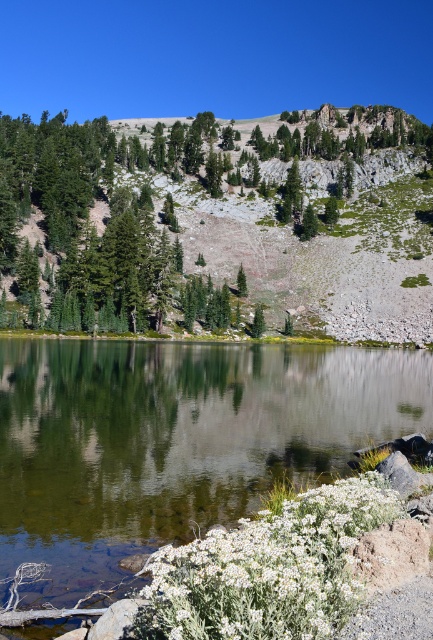
You are standing at the edge of the lake and want to walk towards the two points marked in the image. Which point, point (300, 438) or point (241, 276), will you reach first?

You will reach point (300, 438) first because it is closer to you than point (241, 276).

You are standing at the edge of the lake and want to take a photo of the green leafy trees at upper left. The camera you are using has a zoom lens that can focus on a specific point. If you aim the camera at point (220, 212), will it capture the green leafy trees at upper left?

Yes, because the point (220, 212) is on the green leafy trees at upper left, so aiming the camera there will capture them.